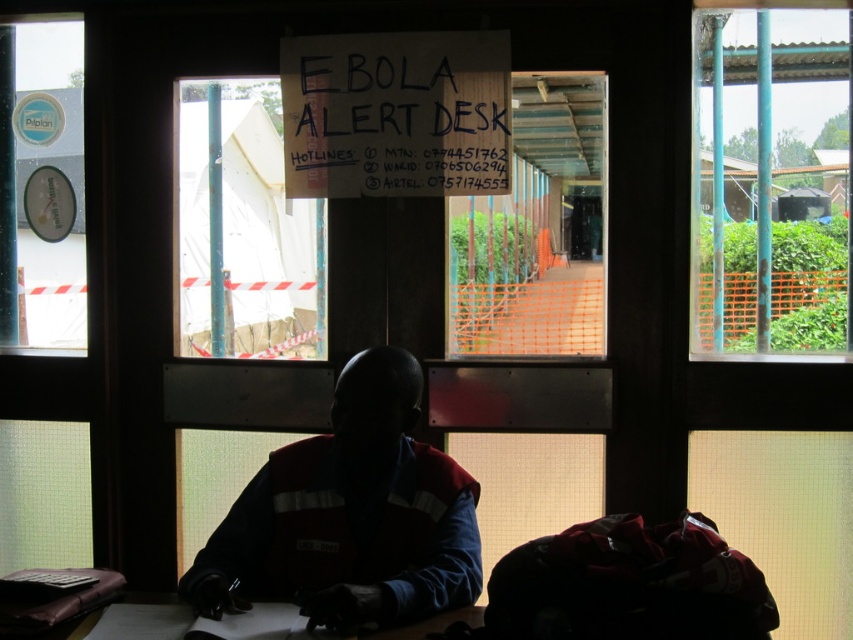
Between wooden signboard at center and orange mesh fence at center, which one is positioned lower?

Positioned lower is orange mesh fence at center.

Who is more distant from viewer, (300, 77) or (567, 260)?

The point (567, 260) is behind.

Between point (468, 44) and point (514, 145), which one is positioned behind?

The point (514, 145) is more distant.

Locate an element on the screen. wooden signboard at center is located at coordinates (396, 115).

Does point (459, 138) come in front of point (289, 572)?

No, it is not.

The image size is (853, 640). Find the location of `wooden signboard at center`. wooden signboard at center is located at coordinates (396, 115).

Can you confirm if dark blue fabric uniform at center is thinner than wooden desk at lower center?

No.

Is dark blue fabric uniform at center smaller than wooden desk at lower center?

Incorrect, dark blue fabric uniform at center is not smaller in size than wooden desk at lower center.

Describe the element at coordinates (351, 515) in the screenshot. I see `dark blue fabric uniform at center` at that location.

What are the coordinates of `dark blue fabric uniform at center` in the screenshot? It's located at click(351, 515).